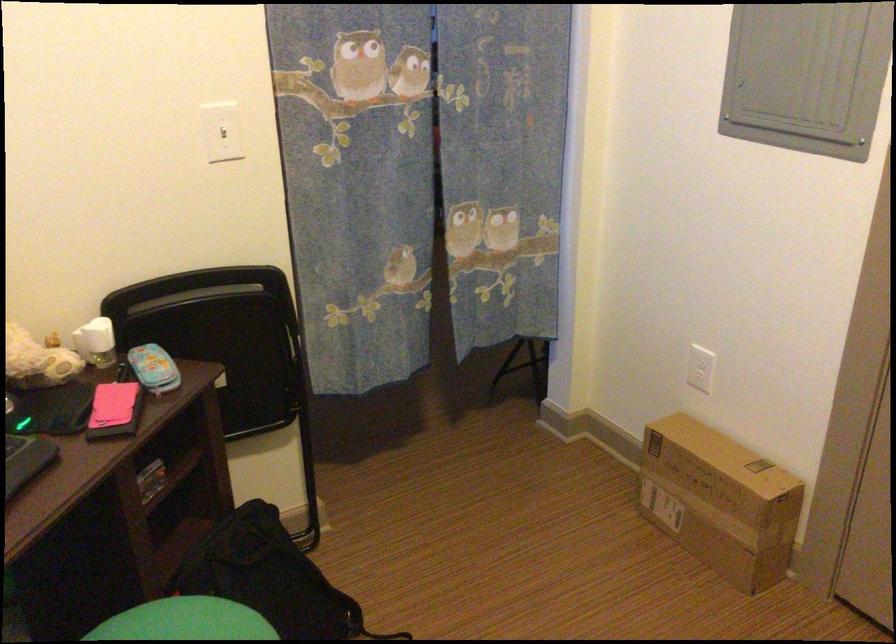
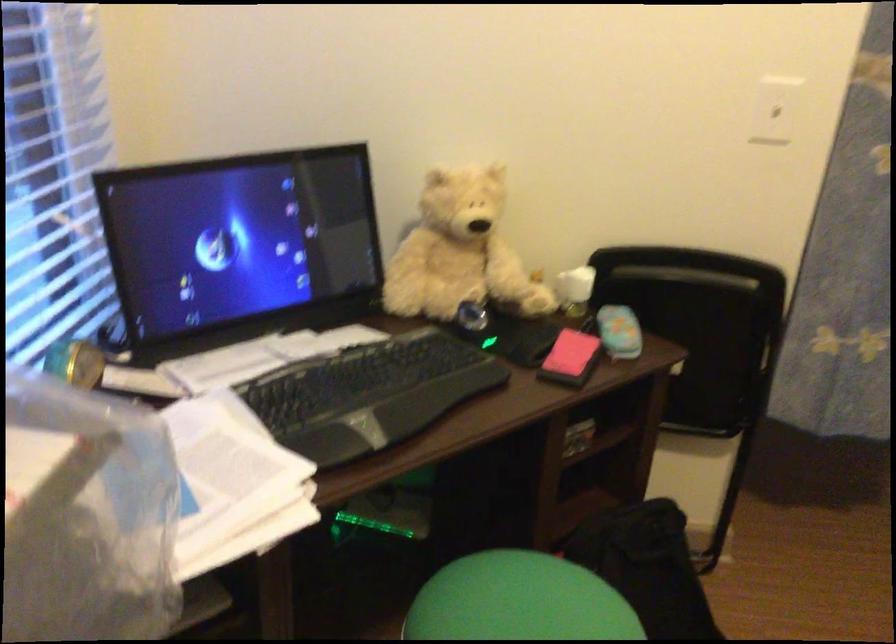
Question: Based on the continuous images, in which direction is the camera rotating? Reply with the corresponding letter.

Choices:
 (A) Left
 (B) Right
 (C) Up
 (D) Down

Answer: (A)